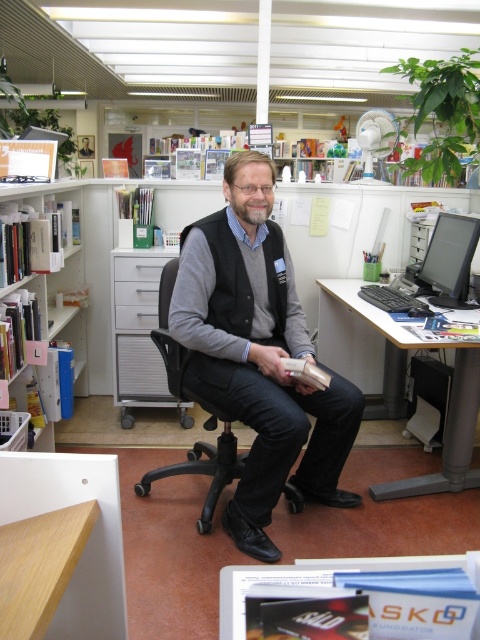
You are a tailor who needs to determine if the gray wool vest at center can be placed on the white plastic computer desk at right without falling off. Based on their sizes, is this possible?

The gray wool vest at center is much taller than the white plastic computer desk at right. Therefore, placing the gray wool vest at center on the white plastic computer desk at right would likely cause it to fall off due to its greater height.

You are standing at the entrance of the office and need to reach the white plastic computer desk at right. Based on the coordinates provided in the Objects Description, can you determine if the desk is positioned near the edge of the room?

The white plastic computer desk at right is located at point (448, 404), which suggests it is positioned near the edge of the room since the coordinates are close to the maximum values on both axes.